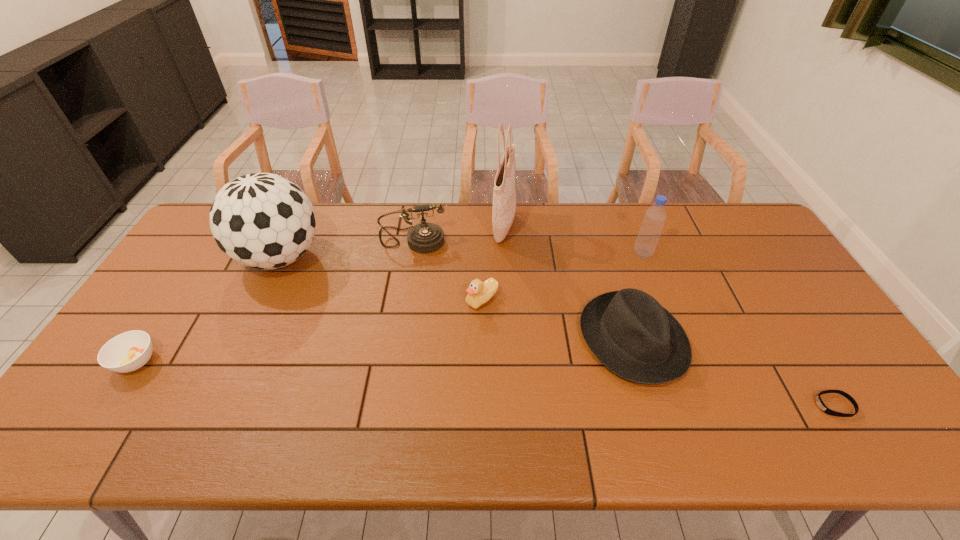
You are a GUI agent. You are given a task and a screenshot of the screen. Output one action in this format:
    pyautogui.click(x=<x>, y=<y>)
    Task: Click on the tallest object
    Image resolution: width=960 pixels, height=540 pixels.
    Given the screenshot: What is the action you would take?
    pyautogui.click(x=504, y=197)

The width and height of the screenshot is (960, 540). Find the location of `the seventh object from right to left`. the seventh object from right to left is located at coordinates (261, 220).

Locate an element on the screen. The image size is (960, 540). soccer ball is located at coordinates (261, 220).

Find the location of `bottle`. bottle is located at coordinates (655, 216).

In order to click on telephone in this screenshot , I will do `click(425, 237)`.

The image size is (960, 540). Find the location of `fedora`. fedora is located at coordinates (629, 331).

Where is `the third shortest object`? the third shortest object is located at coordinates (479, 292).

The height and width of the screenshot is (540, 960). What are the coordinates of `soup bowl` in the screenshot? It's located at (129, 351).

The width and height of the screenshot is (960, 540). Find the location of `the second shortest object`. the second shortest object is located at coordinates click(129, 351).

The width and height of the screenshot is (960, 540). Identify the location of the shortest object. (820, 403).